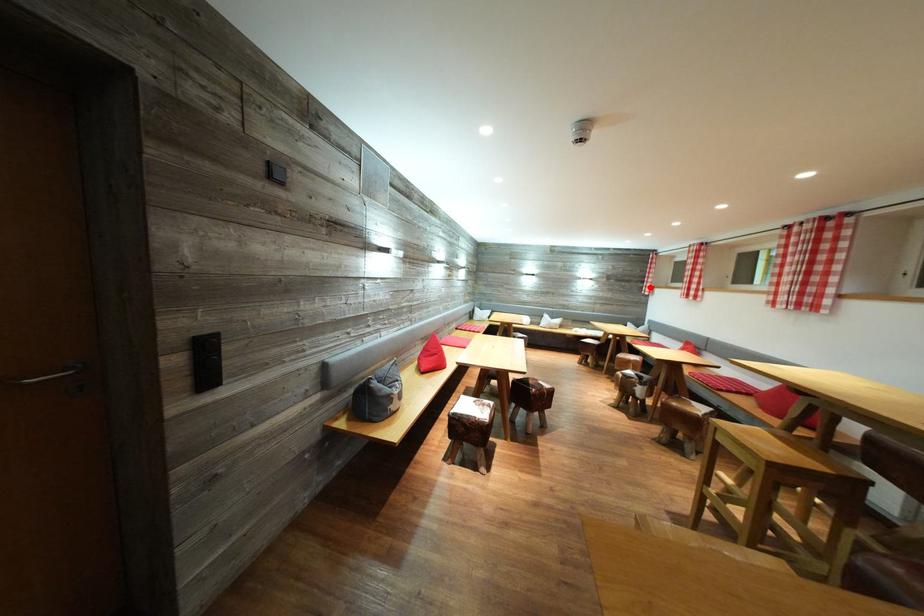
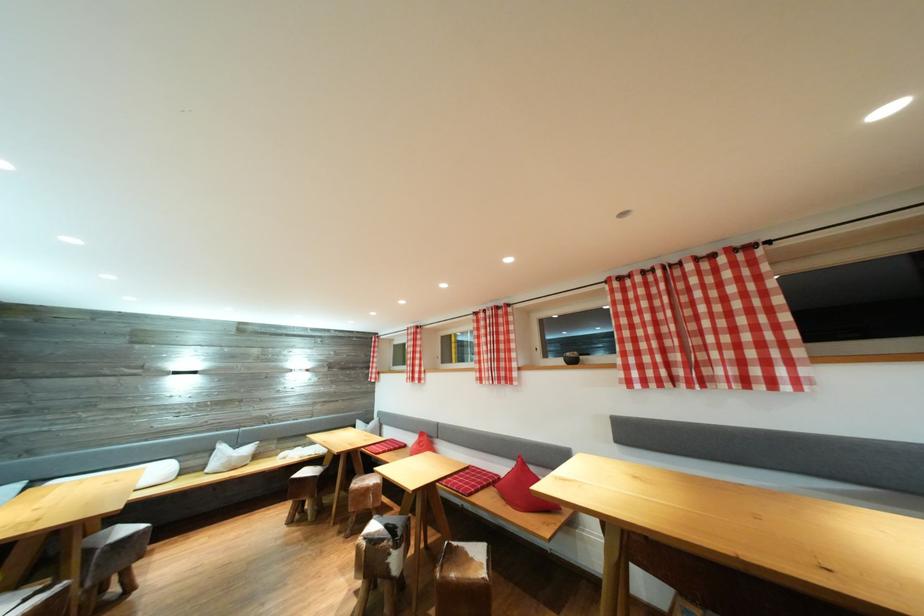
Question: I am providing you with two images of the same scene from different viewpoints. A red point is shown in image1. For the corresponding object point in image2, is it positioned nearer or farther from the camera?

Choices:
 (A) Nearer
 (B) Farther

Answer: (B)